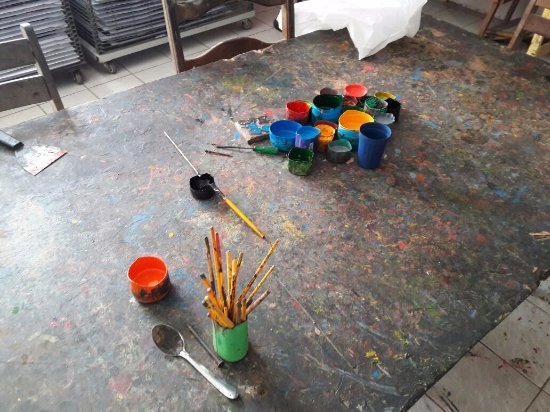
Find the location of a particular element. This screenshot has width=550, height=412. wooden chair is located at coordinates (231, 43).